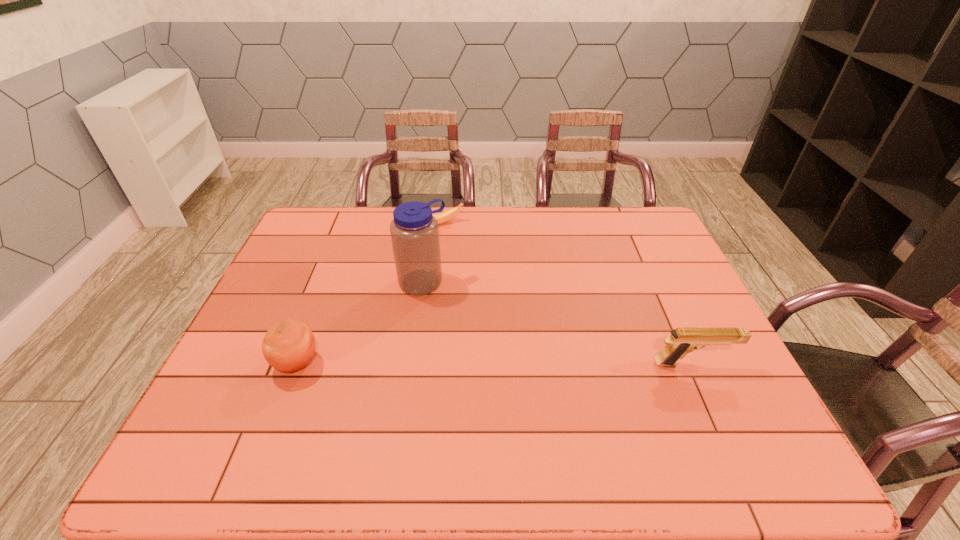
Locate an element on the screen. This screenshot has width=960, height=540. empty location between the rightmost object and the farthest object is located at coordinates (565, 295).

Locate an element on the screen. Image resolution: width=960 pixels, height=540 pixels. object that is the second nearest to the third nearest object is located at coordinates (288, 346).

Locate which object is the closest to the leftmost object. Please provide its 2D coordinates. Your answer should be formatted as a tuple, i.e. [(x, y)], where the tuple contains the x and y coordinates of a point satisfying the conditions above.

[(414, 230)]

You are a GUI agent. You are given a task and a screenshot of the screen. Output one action in this format:
    pyautogui.click(x=<x>, y=<y>)
    Task: Click on the vacant space that satisfies the following two spatial constraints: 1. on the back side of the banana; 2. on the right side of the leftmost object
    The height and width of the screenshot is (540, 960).
    Given the screenshot: What is the action you would take?
    pyautogui.click(x=349, y=226)

Locate an element on the screen. vacant area that satisfies the following two spatial constraints: 1. on the front side of the leftmost object; 2. at the barrel of the pistol is located at coordinates (296, 364).